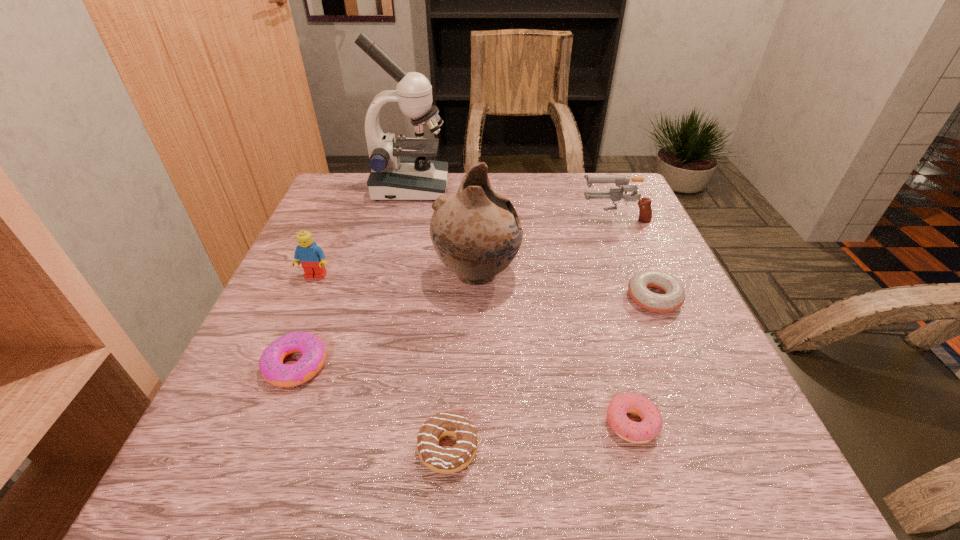
This screenshot has height=540, width=960. In order to click on vacant space that's between the third nearest object and the third doughnut from right to left in this screenshot , I will do `click(372, 407)`.

I want to click on blank region between the pottery and the farthest doughnut, so click(x=565, y=286).

At what (x,y) coordinates should I click in order to perform the action: click on vacant space in between the third nearest doughnut and the farthest object. Please return your answer as a coordinate pair (x, y). The width and height of the screenshot is (960, 540). Looking at the image, I should click on (353, 276).

Where is `empty space between the second doughnut from left to right and the seventh shortest object`? empty space between the second doughnut from left to right and the seventh shortest object is located at coordinates 463,361.

Where is `vacant space that is in between the third doughnut from right to left and the rightmost doughnut`? The height and width of the screenshot is (540, 960). vacant space that is in between the third doughnut from right to left and the rightmost doughnut is located at coordinates (551, 373).

The width and height of the screenshot is (960, 540). I want to click on vacant area that lies between the Lego and the second farthest doughnut, so tap(305, 321).

In order to click on object identified as the sixth closest to the Lego in this screenshot , I will do `click(645, 211)`.

You are a GUI agent. You are given a task and a screenshot of the screen. Output one action in this format:
    pyautogui.click(x=<x>, y=<y>)
    Task: Click on the closest object to the second doughnut from right to left
    This screenshot has width=960, height=540.
    Given the screenshot: What is the action you would take?
    pyautogui.click(x=674, y=297)

Locate an element on the screen. The width and height of the screenshot is (960, 540). doughnut that stands as the closest to the Lego is located at coordinates (273, 370).

Find the location of `the third closest doughnut to the Lego`. the third closest doughnut to the Lego is located at coordinates (641, 432).